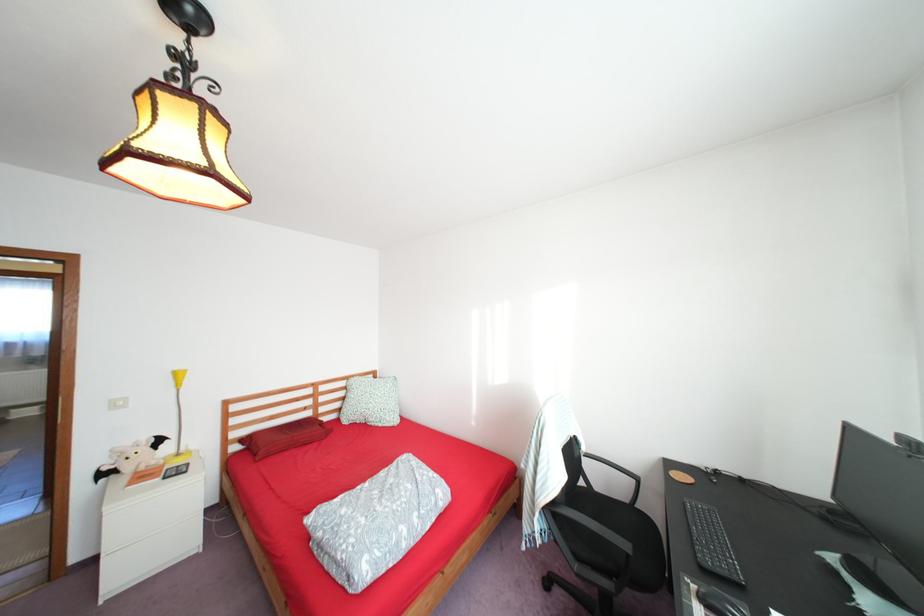
This screenshot has width=924, height=616. Identify the location of folded patterned blanket. (375, 522).